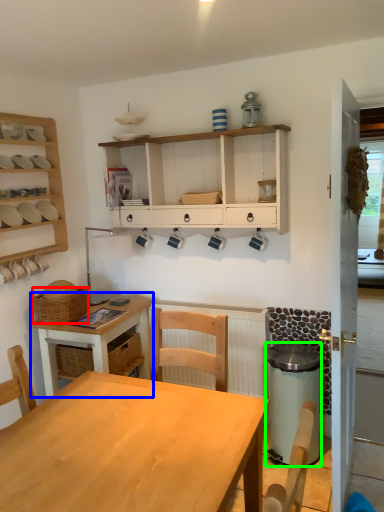
Question: Which object is positioned farthest from basket (highlighted by a red box)? Select from desk (highlighted by a blue box) and trash bin/can (highlighted by a green box).

Choices:
 (A) desk
 (B) trash bin/can

Answer: (B)